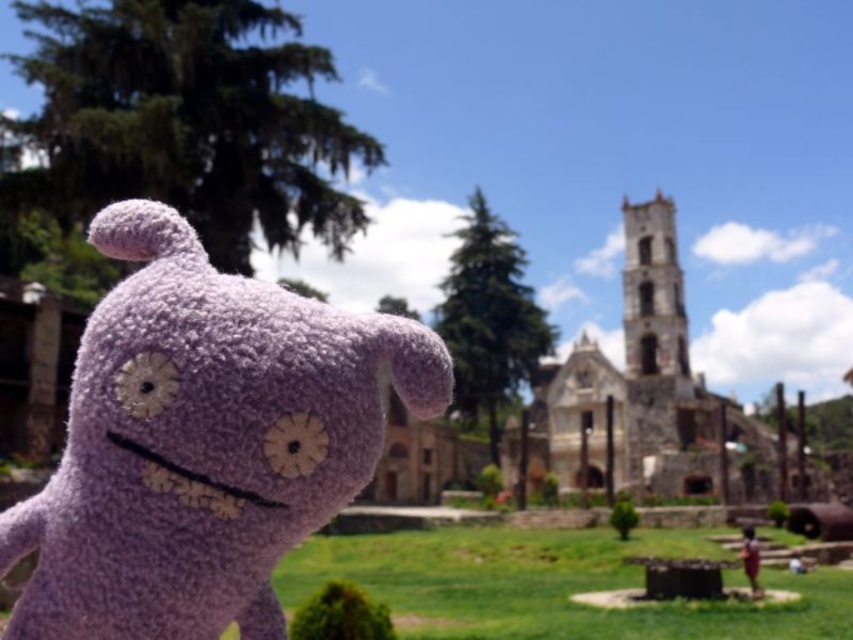
You are standing in front of the stone church at center and want to place a gift for a child. Where should you place it so the purple fuzzy toy at left can easily see it?

Place the gift to the right of the stone church at center so the purple fuzzy toy at left can see it, as the purple fuzzy toy at left is positioned to the left of the stone church at center.

You are standing in a park and see the purple fuzzy toy at left and the stone church at center. Which object is closer to you?

The purple fuzzy toy at left is closer to you because it is smaller in size compared to the stone church at center, which is further away.